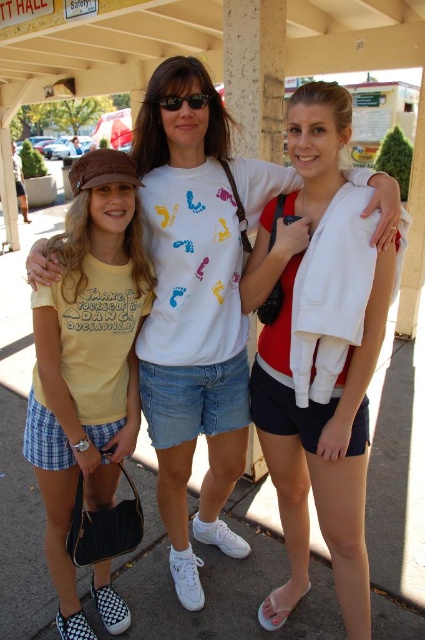
Can you confirm if white cotton jacket at center is thinner than black plastic sunglasses at center?

No.

I want to click on white cotton jacket at center, so click(x=333, y=381).

Does white cotton jacket at center have a greater height compared to yellow cotton t-shirt at left?

Yes.

Between white cotton jacket at center and yellow cotton t-shirt at left, which one appears on the left side from the viewer's perspective?

From the viewer's perspective, yellow cotton t-shirt at left appears more on the left side.

Is point (280, 490) closer to camera compared to point (91, 493)?

No, (280, 490) is further to viewer.

This screenshot has width=425, height=640. Find the location of `white cotton jacket at center`. white cotton jacket at center is located at coordinates (333, 381).

Who is positioned more to the right, yellow cotton t-shirt at left or black plastic sunglasses at center?

black plastic sunglasses at center is more to the right.

Is yellow cotton t-shirt at left to the right of black plastic sunglasses at center from the viewer's perspective?

In fact, yellow cotton t-shirt at left is to the left of black plastic sunglasses at center.

Who is more distant from viewer, (61, 468) or (161, 106)?

Point (61, 468)

Where is `yellow cotton t-shirt at left`? yellow cotton t-shirt at left is located at coordinates (87, 358).